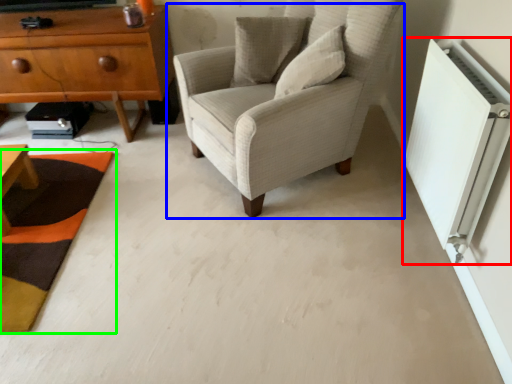
Question: Which is farther away from air conditioning (highlighted by a red box)? chair (highlighted by a blue box) or mat (highlighted by a green box)?

Choices:
 (A) chair
 (B) mat

Answer: (B)